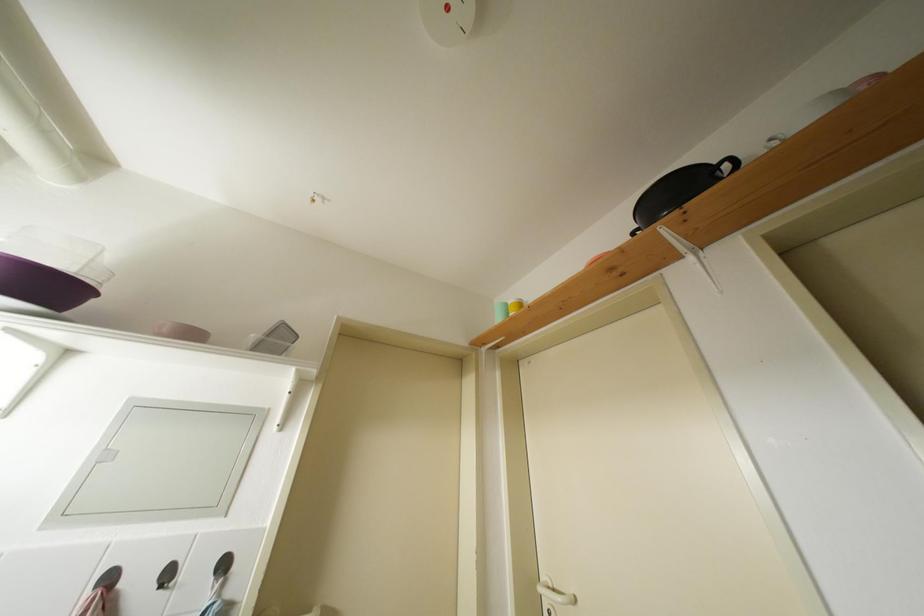
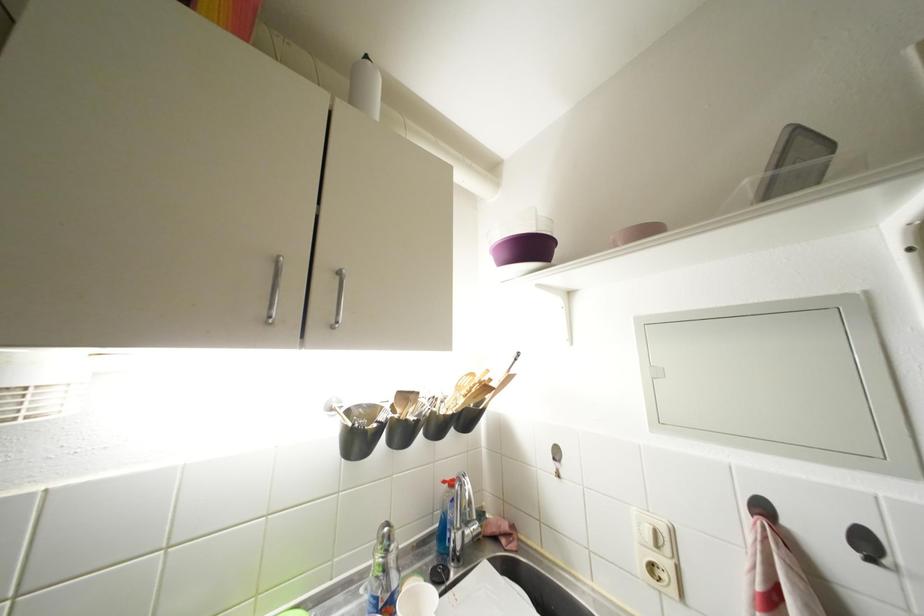
Find the pixel in the second image that matches point (117, 583) in the first image.

(770, 513)